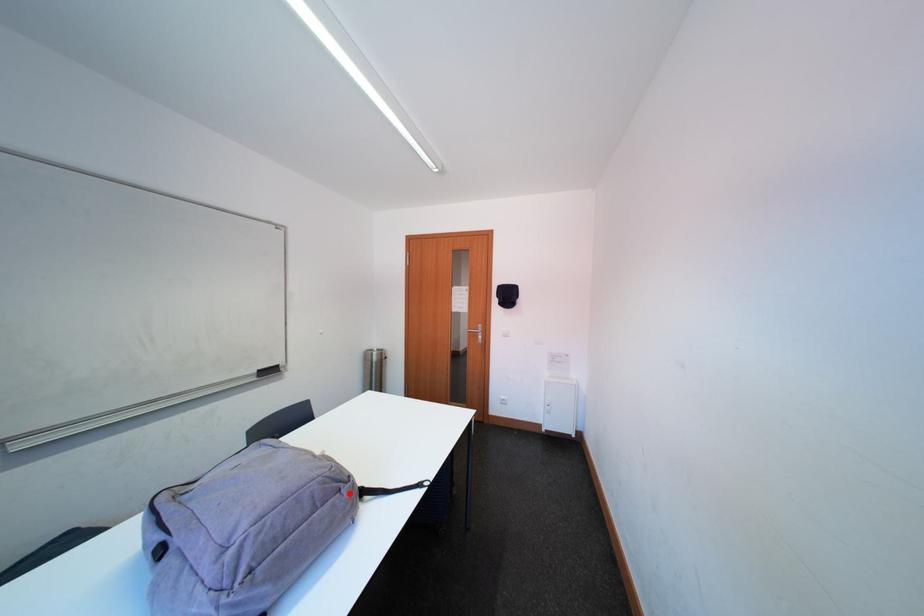
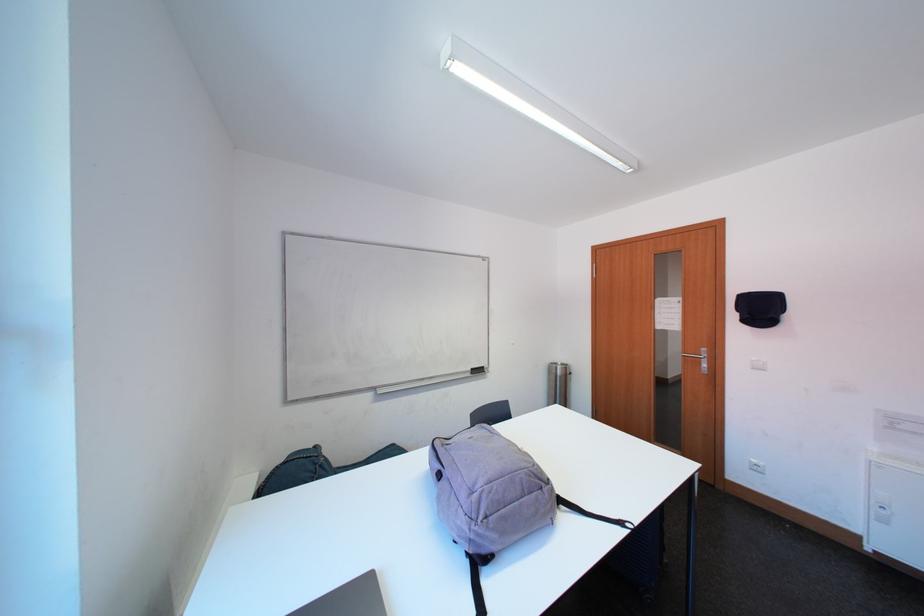
Question: I am providing you with two images of the same scene from different viewpoints. In image1, a red point is highlighted. Considering the same 3D point in image2, which of the following is correct?

Choices:
 (A) It is closer
 (B) It is farther

Answer: (B)